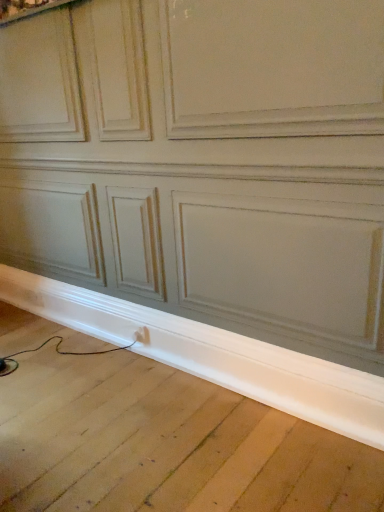
What do you see at coordinates (214, 355) in the screenshot? This screenshot has height=512, width=384. I see `white wood baseboard at lower center` at bounding box center [214, 355].

Identify the location of white wood baseboard at lower center. (214, 355).

The width and height of the screenshot is (384, 512). Find the location of `white wood baseboard at lower center`. white wood baseboard at lower center is located at coordinates [x=214, y=355].